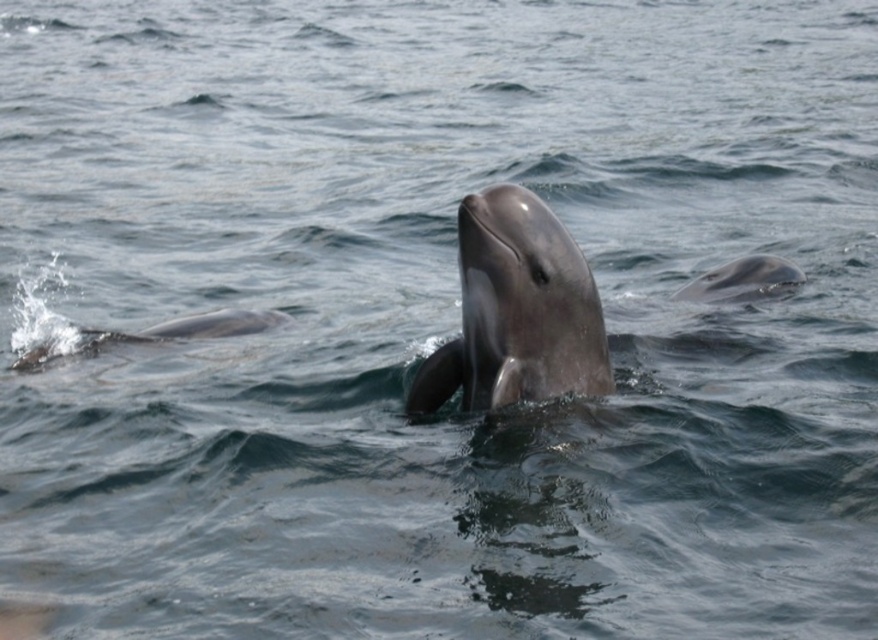
From the picture: Measure the distance between smooth gray dolphin at center and camera.

4.82 meters

Between smooth gray dolphin at center and gray smooth dolphin at left, which one is positioned lower?

smooth gray dolphin at center is below.

Measure the distance between point (524,358) and camera.

They are 5.55 meters apart.

The image size is (878, 640). Find the location of `smooth gray dolphin at center`. smooth gray dolphin at center is located at coordinates (517, 310).

Who is more distant from viewer, (x=236, y=333) or (x=761, y=296)?

The point (x=761, y=296) is behind.

Between gray smooth dolphin at left and gray smooth dolphin at upper right, which one has more height?

With more height is gray smooth dolphin at left.

In order to click on gray smooth dolphin at left in this screenshot , I will do `click(186, 328)`.

Locate an element on the screen. gray smooth dolphin at left is located at coordinates click(186, 328).

Between smooth gray dolphin at center and gray smooth dolphin at upper right, which one is positioned lower?

smooth gray dolphin at center is lower down.

Can you confirm if smooth gray dolphin at center is shorter than gray smooth dolphin at upper right?

No, smooth gray dolphin at center is not shorter than gray smooth dolphin at upper right.

What are the coordinates of `smooth gray dolphin at center` in the screenshot? It's located at (517, 310).

I want to click on smooth gray dolphin at center, so click(517, 310).